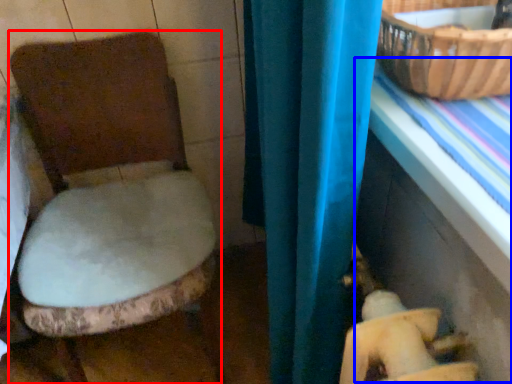
Question: Which object is further to the camera taking this photo, toilet (highlighted by a red box) or table (highlighted by a blue box)?

Choices:
 (A) toilet
 (B) table

Answer: (A)